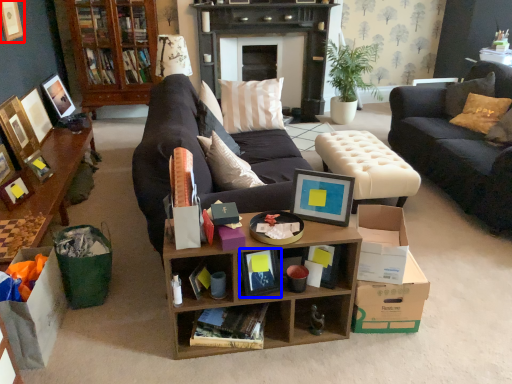
Question: Among these objects, which one is nearest to the camera, picture frame (highlighted by a red box) or book (highlighted by a blue box)?

Choices:
 (A) picture frame
 (B) book

Answer: (B)